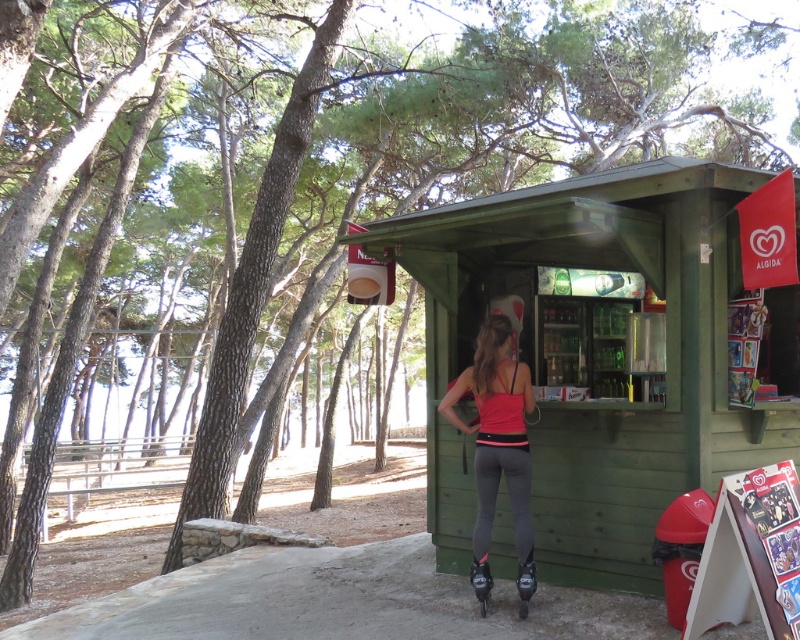
Question: Where is green wooden hut at center located in relation to matte pink tank top at center in the image?

Choices:
 (A) above
 (B) below

Answer: (A)

Question: Which of the following is the farthest from the observer?

Choices:
 (A) (437, 352)
 (B) (524, 396)

Answer: (A)

Question: Among these points, which one is farthest from the camera?

Choices:
 (A) (462, 257)
 (B) (482, 593)
 (C) (478, 420)

Answer: (A)

Question: Is matte pink tank top at center smaller than black matte roller skates at lower center?

Choices:
 (A) yes
 (B) no

Answer: (B)

Question: Can you confirm if green wooden hut at center is positioned to the left of black rubber roller skates at lower center?

Choices:
 (A) yes
 (B) no

Answer: (B)

Question: Among these points, which one is farthest from the camera?

Choices:
 (A) (490, 298)
 (B) (478, 364)
 (C) (488, 580)

Answer: (A)